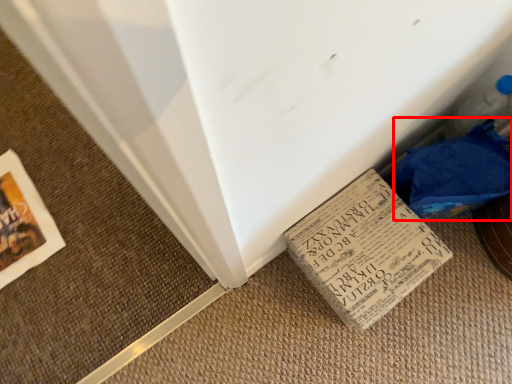
Question: From the image's perspective, where is material (annotated by the red box) located in relation to book in the image?

Choices:
 (A) below
 (B) above

Answer: (B)